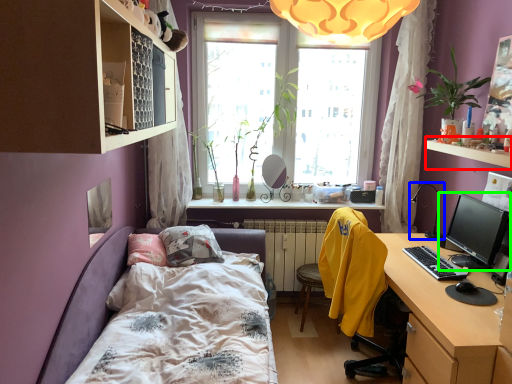
Question: Estimate the real-world distances between objects in this image. Which object is closer to window sill (highlighted by a red box), table lamp (highlighted by a blue box) or computer monitor (highlighted by a green box)?

Choices:
 (A) table lamp
 (B) computer monitor

Answer: (B)